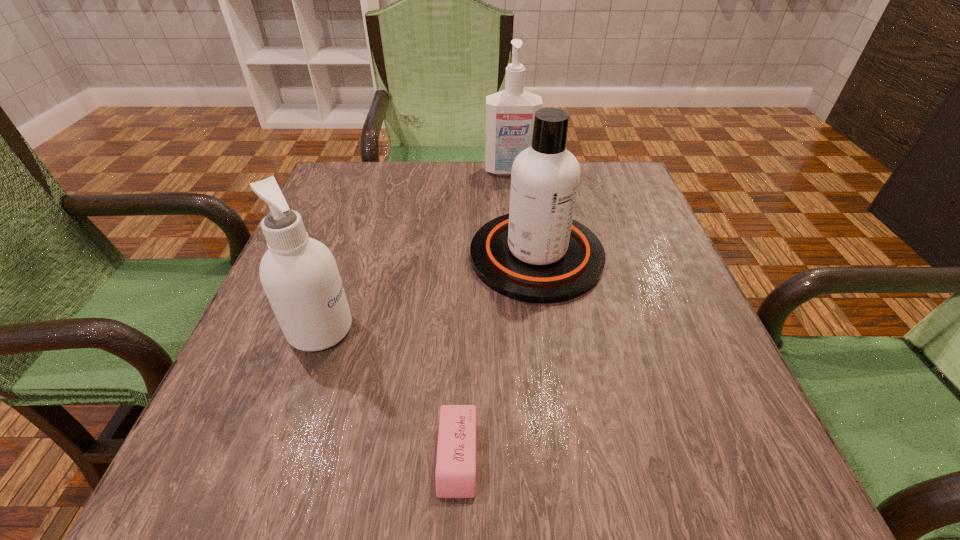
Locate an element on the screen. object that is at the far edge is located at coordinates (510, 113).

Find the location of `object positioned at the near edge`. object positioned at the near edge is located at coordinates (455, 476).

The width and height of the screenshot is (960, 540). Find the location of `object at the left edge`. object at the left edge is located at coordinates (299, 274).

Where is `object that is at the right edge`? This screenshot has height=540, width=960. object that is at the right edge is located at coordinates (537, 253).

In the image, there is a desktop. Where is `vacant space at the far edge`? vacant space at the far edge is located at coordinates (459, 178).

The height and width of the screenshot is (540, 960). I want to click on free space at the left edge of the desktop, so click(x=286, y=352).

You are a GUI agent. You are given a task and a screenshot of the screen. Output one action in this format:
    pyautogui.click(x=<x>, y=<y>)
    Task: Click on the free space at the right edge of the desktop
    Image resolution: width=960 pixels, height=540 pixels.
    Given the screenshot: What is the action you would take?
    (x=611, y=267)

Locate an element on the screen. free space at the far left corner is located at coordinates coord(318,195).

The image size is (960, 540). Identify the location of vacant area at the far right corner. (591, 183).

Identify the location of vacant space at the near right corner. (693, 462).